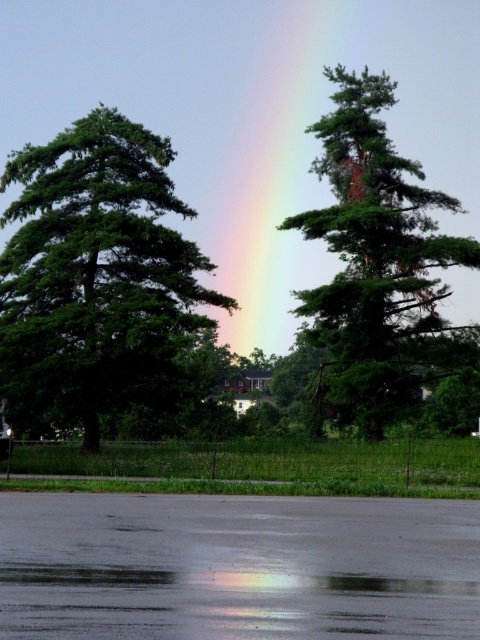
Question: Which of these objects is positioned farthest from the green leafy tree at left?

Choices:
 (A) rainbow at center
 (B) green matte tree at center

Answer: (A)

Question: Is green leafy tree at left positioned behind rainbow at center?

Choices:
 (A) no
 (B) yes

Answer: (A)

Question: Which object is positioned farthest from the green leafy tree at left?

Choices:
 (A) green matte tree at center
 (B) rainbow at center

Answer: (B)

Question: Does green leafy tree at left appear on the right side of green matte tree at center?

Choices:
 (A) no
 (B) yes

Answer: (A)

Question: In this image, where is green leafy tree at left located relative to rainbow at center?

Choices:
 (A) right
 (B) left

Answer: (B)

Question: Among these objects, which one is farthest from the camera?

Choices:
 (A) rainbow at center
 (B) green leafy tree at left
 (C) green matte tree at center

Answer: (A)